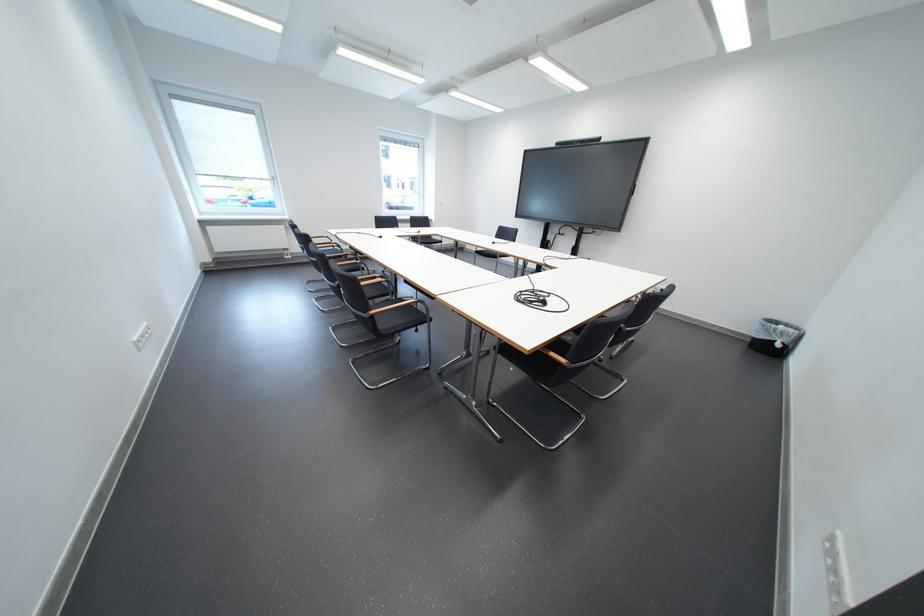
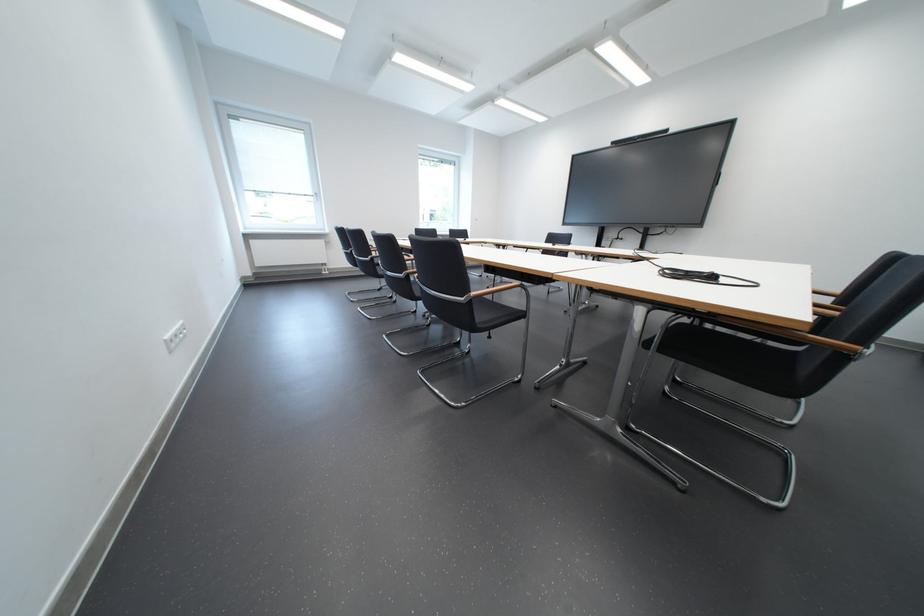
The images are taken continuously from a first-person perspective. In which direction are you moving?

The movement direction of the cameraman is left, forward.